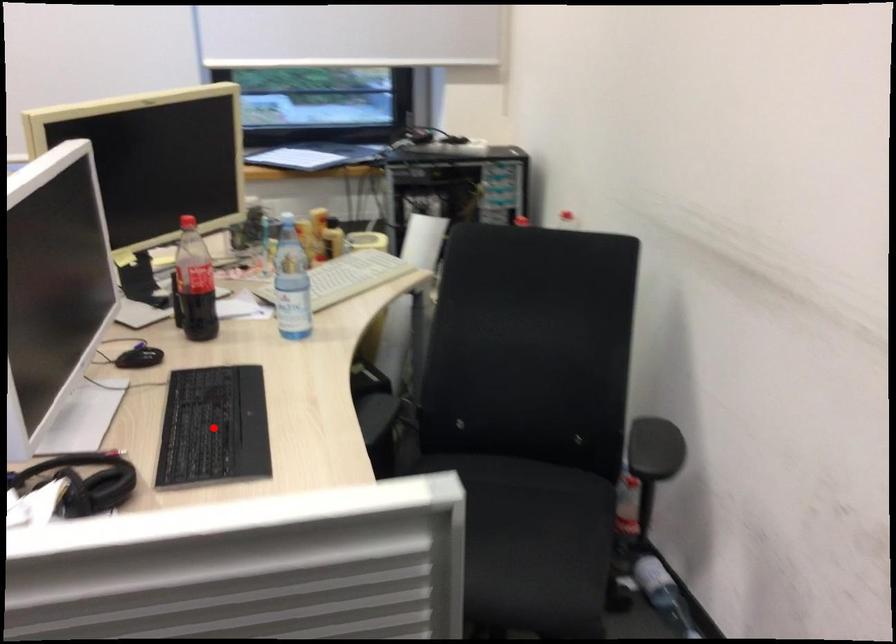
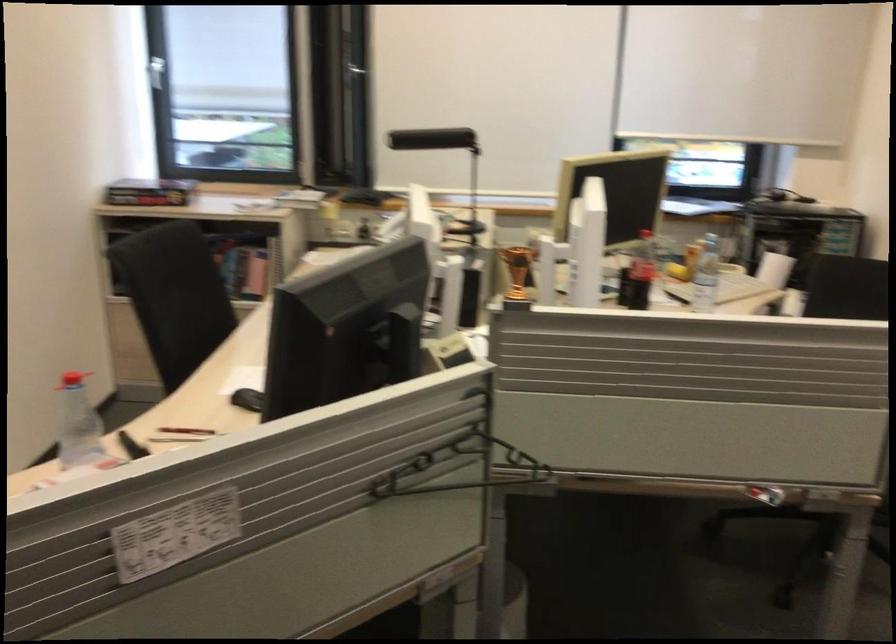
Question: I am providing you with two images of the same scene from different viewpoints. A red point is marked on the first image. Can you still see the location of the red point in image 2?

Choices:
 (A) Yes
 (B) No

Answer: (B)